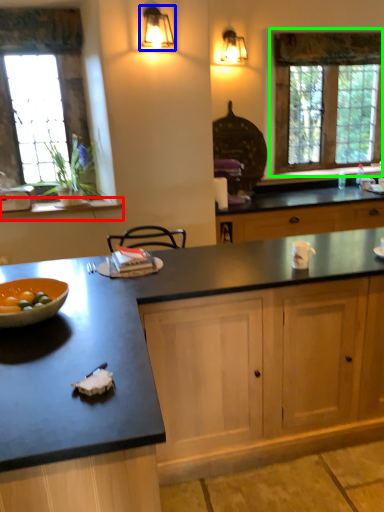
Question: Which is nearer to the window sill (highlighted by a red box)? light fixture (highlighted by a blue box) or window (highlighted by a green box).

Choices:
 (A) light fixture
 (B) window

Answer: (A)